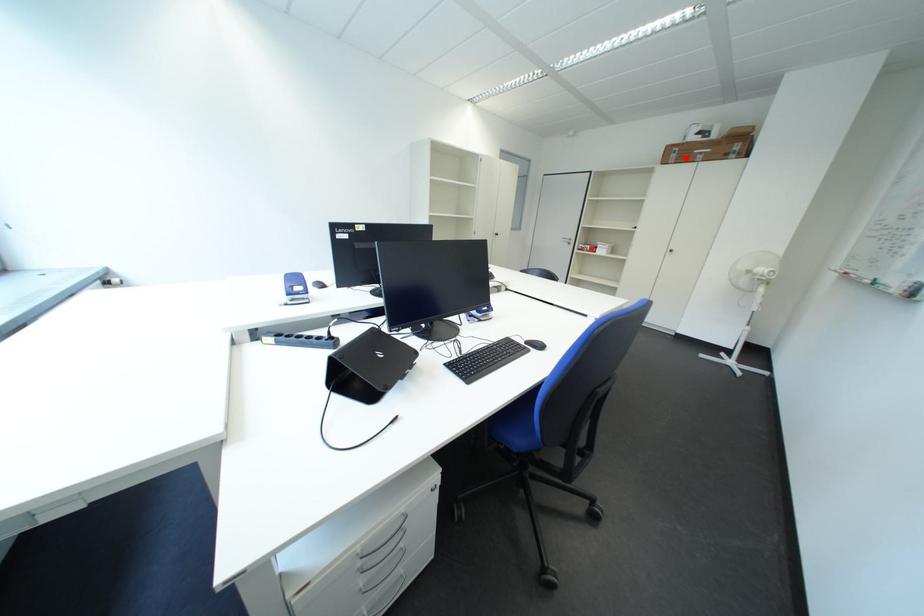
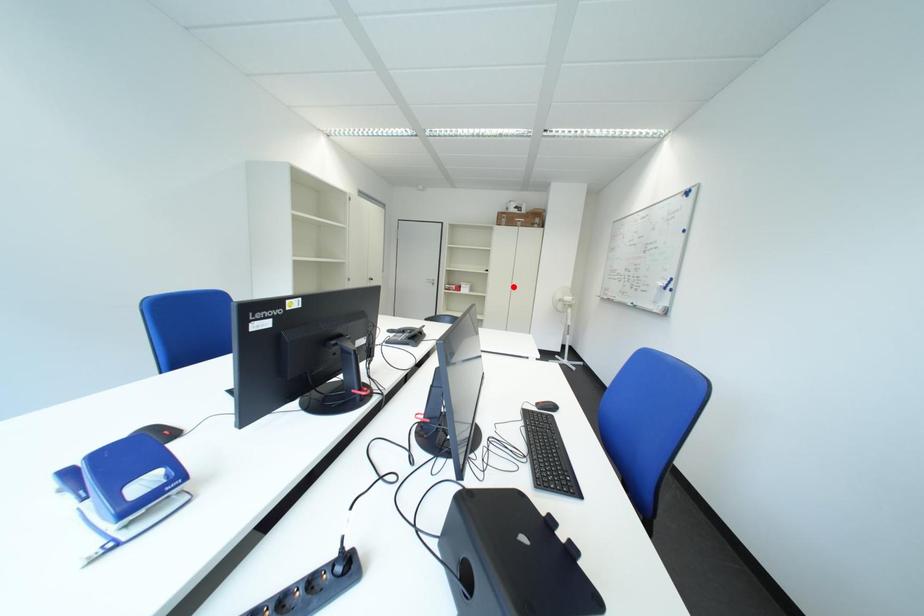
I am providing you with two images of the same scene from different viewpoints. A red point is marked on the first image and another point is marked on the second image. Is the red point in image1 aligned with the point shown in image2?

No